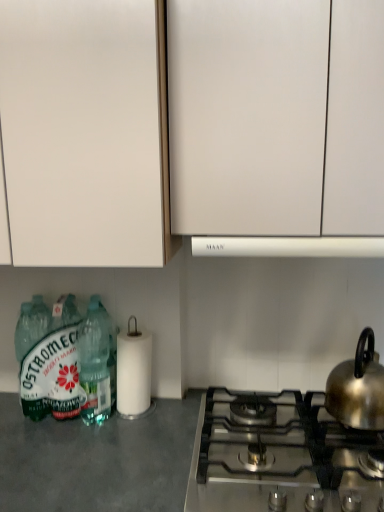
Question: Can you confirm if white matte cabinet at upper left, placed as the 1th cabinetry when sorted from left to right, is positioned to the right of satin silver gas stove at lower right?

Choices:
 (A) yes
 (B) no

Answer: (B)

Question: From the image's perspective, is white matte cabinet at upper left, the second cabinetry from the right, beneath satin silver gas stove at lower right?

Choices:
 (A) yes
 (B) no

Answer: (B)

Question: Does white matte cabinet at upper left, placed as the 1th cabinetry when sorted from left to right, have a greater width compared to satin silver gas stove at lower right?

Choices:
 (A) yes
 (B) no

Answer: (B)

Question: Can you confirm if white matte cabinet at upper left, the second cabinetry from the right, is bigger than satin silver gas stove at lower right?

Choices:
 (A) no
 (B) yes

Answer: (B)

Question: Would you say white matte cabinet at upper left, the second cabinetry from the right, contains satin silver gas stove at lower right?

Choices:
 (A) yes
 (B) no

Answer: (B)

Question: Is point (89, 155) positioned closer to the camera than point (120, 344)?

Choices:
 (A) closer
 (B) farther

Answer: (A)

Question: From the image's perspective, relative to white matte paper towel at lower center, is white matte cabinet at upper left, the second cabinetry from the right, above or below?

Choices:
 (A) above
 (B) below

Answer: (A)

Question: Looking at the image, does white matte cabinet at upper left, the second cabinetry from the right, seem bigger or smaller compared to white matte paper towel at lower center?

Choices:
 (A) small
 (B) big

Answer: (B)

Question: Is white matte cabinet at upper left, placed as the 1th cabinetry when sorted from left to right, wider or thinner than white matte paper towel at lower center?

Choices:
 (A) thin
 (B) wide

Answer: (B)

Question: From a real-world perspective, relative to shiny metallic kettle at right, is gray matte countertop at lower left vertically above or below?

Choices:
 (A) above
 (B) below

Answer: (B)

Question: Would you say gray matte countertop at lower left is inside or outside shiny metallic kettle at right?

Choices:
 (A) outside
 (B) inside

Answer: (A)

Question: Based on their sizes in the image, would you say gray matte countertop at lower left is bigger or smaller than shiny metallic kettle at right?

Choices:
 (A) small
 (B) big

Answer: (B)

Question: Is gray matte countertop at lower left to the left or to the right of shiny metallic kettle at right in the image?

Choices:
 (A) left
 (B) right

Answer: (A)

Question: Is shiny metallic kettle at right taller or shorter than white matte cabinet at upper left, placed as the 1th cabinetry when sorted from left to right?

Choices:
 (A) short
 (B) tall

Answer: (A)

Question: In the image, is shiny metallic kettle at right positioned in front of or behind white matte cabinet at upper left, placed as the 1th cabinetry when sorted from left to right?

Choices:
 (A) behind
 (B) front

Answer: (A)